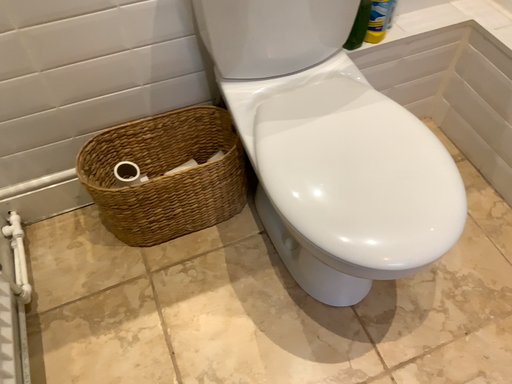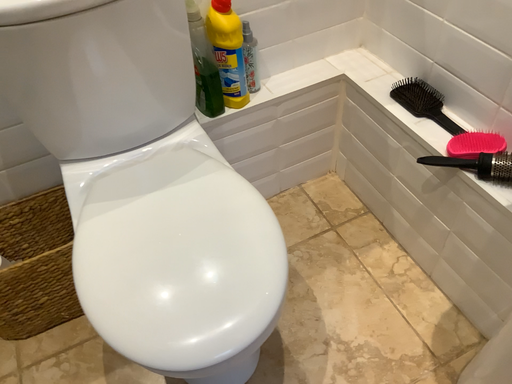
Question: Which way did the camera rotate in the video?

Choices:
 (A) rotated upward
 (B) rotated downward

Answer: (A)